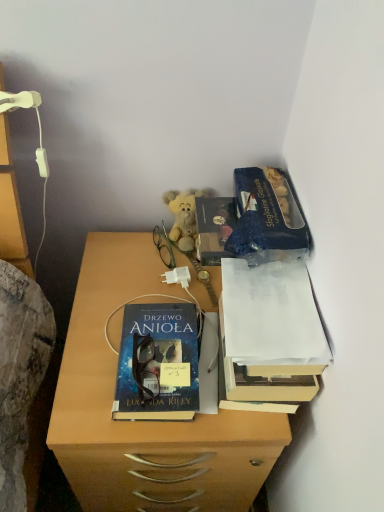
Image resolution: width=384 pixels, height=512 pixels. Identify the location of vacant location behind blue glossy book at center, the first book viewed from the left. (145, 284).